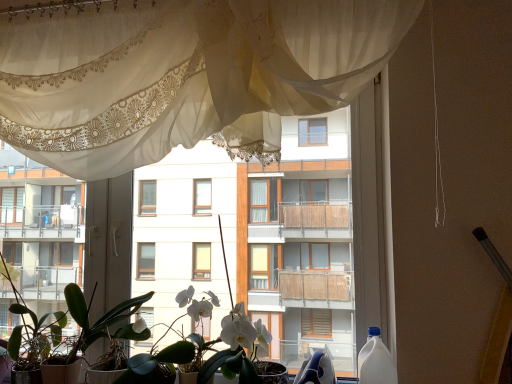
Question: Is sheer white curtain at upper center inside or outside of white matte orchid at center?

Choices:
 (A) outside
 (B) inside

Answer: (A)

Question: From a real-world perspective, is sheer white curtain at upper center physically located above or below white matte orchid at center?

Choices:
 (A) below
 (B) above

Answer: (B)

Question: Which is nearer to the white plastic bottle at right?

Choices:
 (A) white matte orchid at center
 (B) white glossy balcony at left
 (C) green matte plant at lower left
 (D) sheer white curtain at upper center

Answer: (A)

Question: Estimate the real-world distances between objects in this image. Which object is closer to the green matte plant at lower left?

Choices:
 (A) white plastic bottle at right
 (B) white matte orchid at center
 (C) sheer white curtain at upper center
 (D) white glossy balcony at left

Answer: (D)